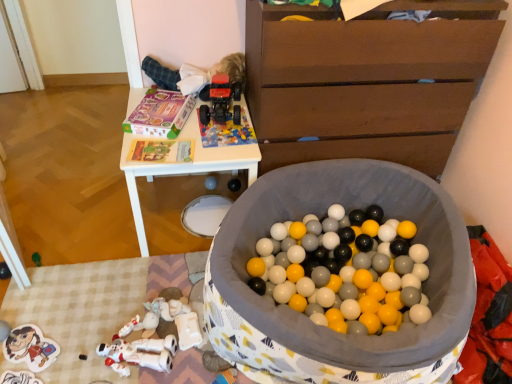
Find the location of a particular element. The width and height of the screenshot is (512, 384). unoccupied space behind white matte plastic robot at lower left, which is the 2th toy from left to right is located at coordinates (145, 295).